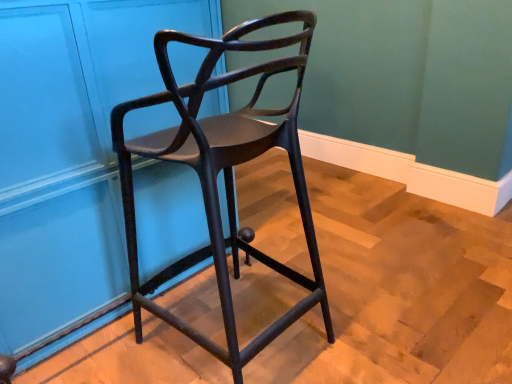
Find the location of a particular element. spots to the right of matte black chair at center is located at coordinates (381, 310).